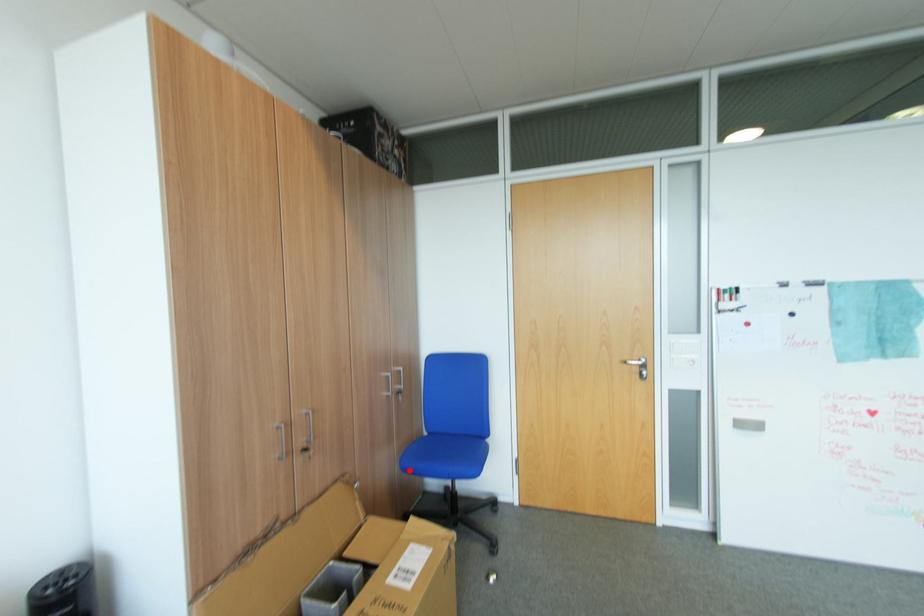
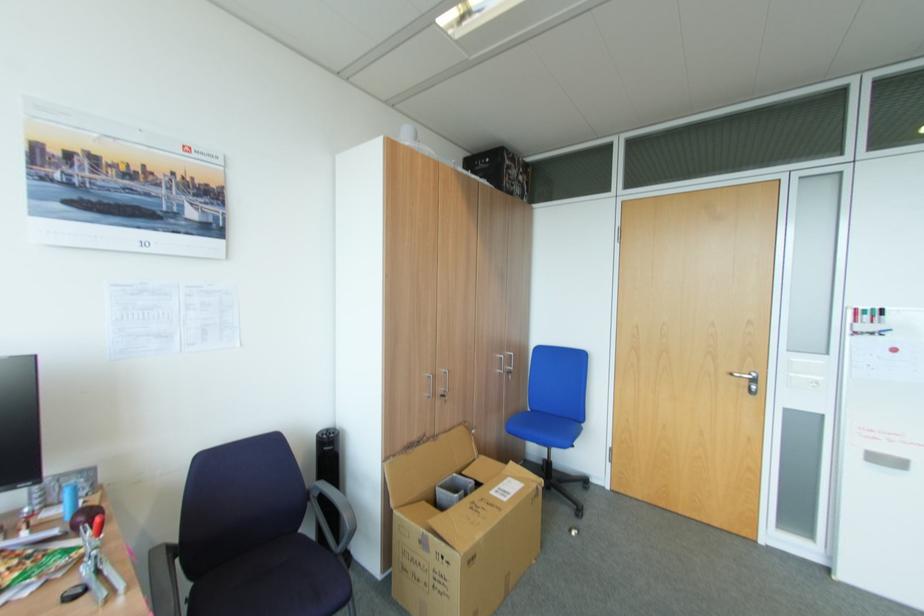
The point at the highlighted location is marked in the first image. Where is the corresponding point in the second image?

(515, 431)